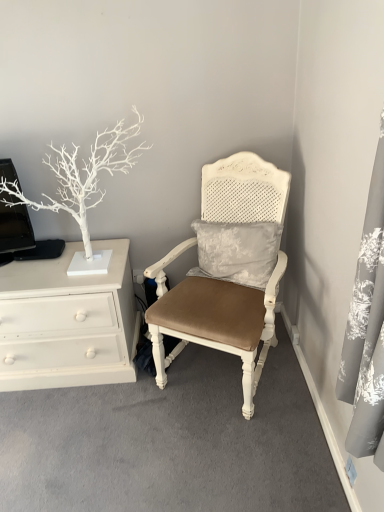
Question: In the image, is white painted wood chest of drawers at left on the left side or the right side of matte white chair at center?

Choices:
 (A) left
 (B) right

Answer: (A)

Question: In terms of size, does white painted wood chest of drawers at left appear bigger or smaller than matte white chair at center?

Choices:
 (A) big
 (B) small

Answer: (B)

Question: Which is nearer to the white matte tree at left?

Choices:
 (A) matte white chair at center
 (B) white painted wood chest of drawers at left

Answer: (B)

Question: Which of these objects is positioned closest to the white painted wood chest of drawers at left?

Choices:
 (A) matte white chair at center
 (B) white matte tree at left

Answer: (B)